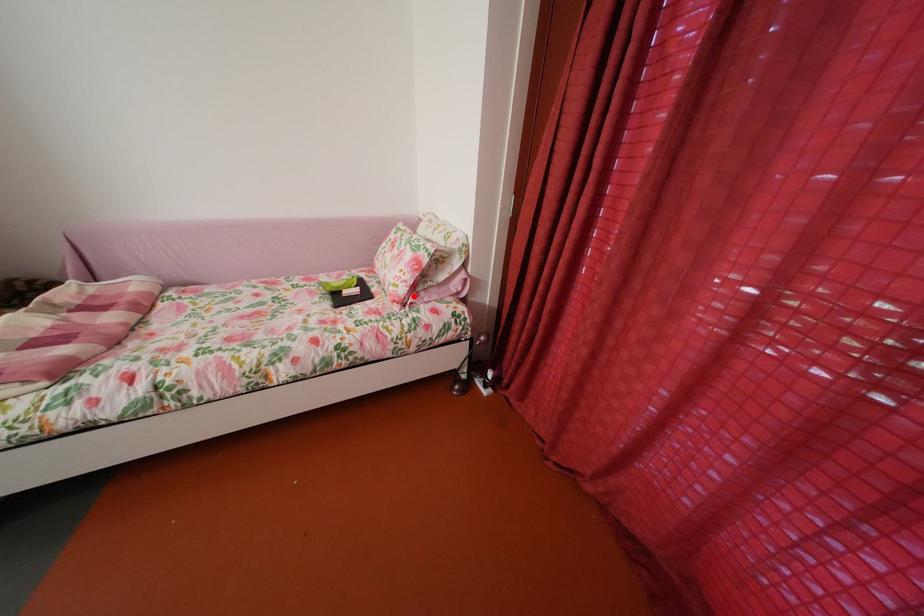
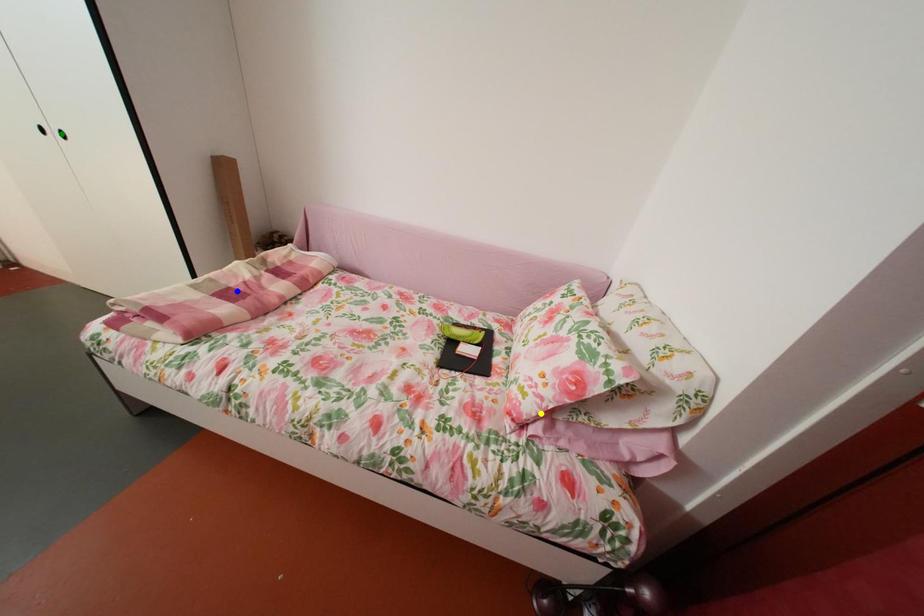
Question: I am providing you with two images of the same scene from different viewpoints. A red point is marked on the first image. You are given multiple points on the second image. Which point in image 2 represents the same 3d spot as the red point in image 1?

Choices:
 (A) yellow point
 (B) blue point
 (C) green point

Answer: (A)